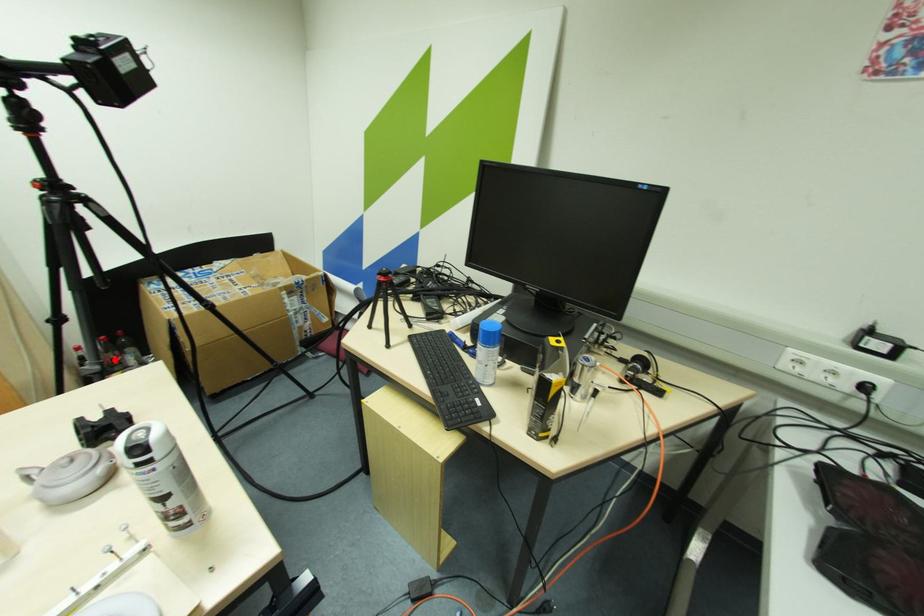
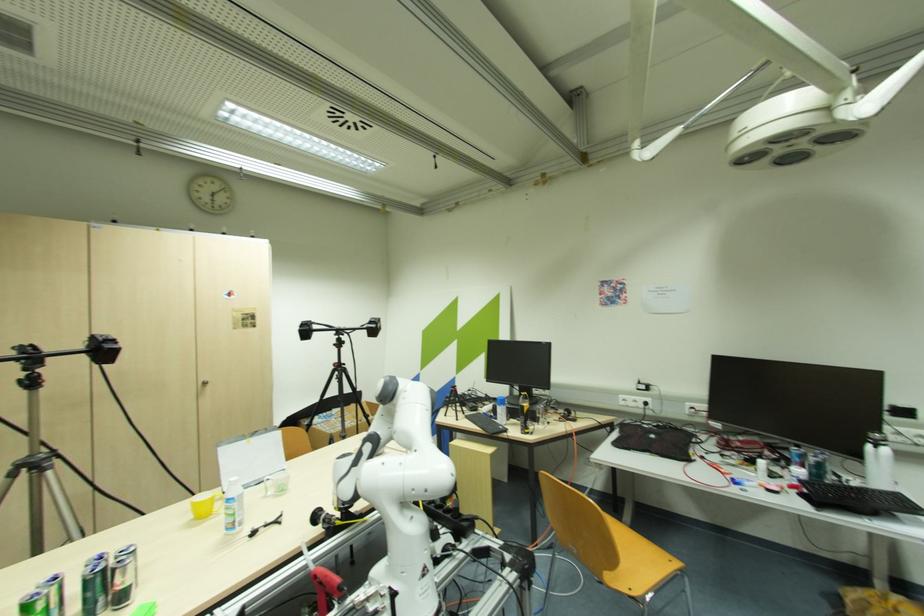
Question: I am providing you with two images of the same scene from different viewpoints. A red point is marked on the first image. Can you still see the location of the red point in image 2?

Choices:
 (A) Yes
 (B) No

Answer: (B)